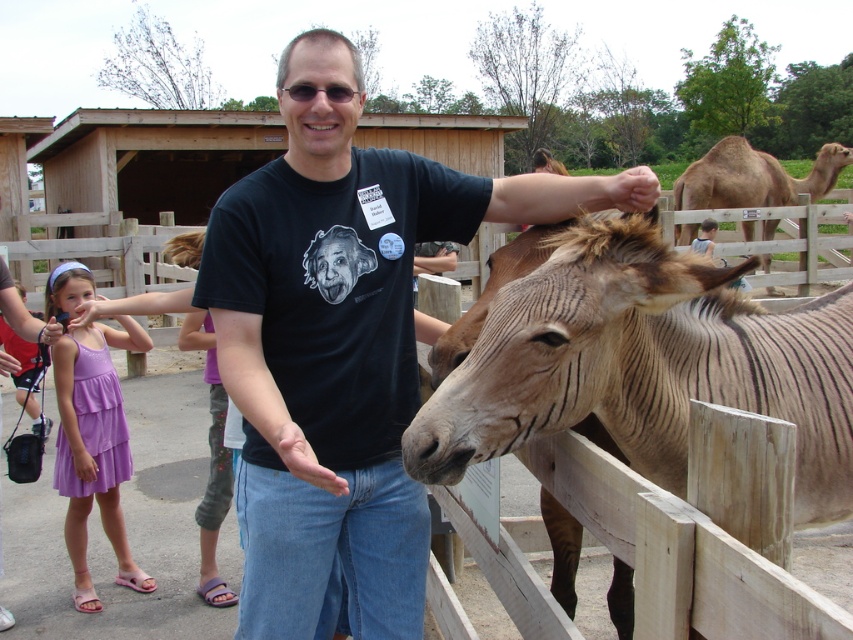
Can you confirm if brown textured donkey at upper right is positioned to the left of matte black hand at upper center?

In fact, brown textured donkey at upper right is to the right of matte black hand at upper center.

Does brown textured donkey at upper right have a larger size compared to matte black hand at upper center?

Correct, brown textured donkey at upper right is larger in size than matte black hand at upper center.

Which is in front, point (770, 173) or point (608, 200)?

Positioned in front is point (608, 200).

Where is `brown textured donkey at upper right`? Image resolution: width=853 pixels, height=640 pixels. brown textured donkey at upper right is located at coordinates (753, 177).

Is point (517, 356) farther from camera compared to point (682, 189)?

That is False.

Is point (851, 305) positioned in front of point (767, 240)?

Yes, point (851, 305) is in front of point (767, 240).

Find the location of a particular element. The width and height of the screenshot is (853, 640). brown textured donkey at center is located at coordinates (639, 362).

Between black cotton t-shirt at center and purple cotton dress at lower left, which one is positioned lower?

purple cotton dress at lower left is below.

Can you confirm if black cotton t-shirt at center is positioned to the left of purple cotton dress at lower left?

No, black cotton t-shirt at center is not to the left of purple cotton dress at lower left.

Where is `black cotton t-shirt at center`? black cotton t-shirt at center is located at coordinates (335, 346).